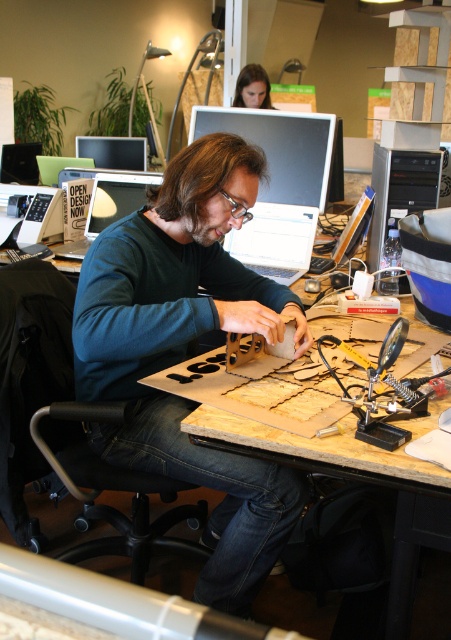
Question: Does blue matte shirt at center appear on the left side of matte black hair at upper center?

Choices:
 (A) yes
 (B) no

Answer: (A)

Question: Is matte black laptop at upper left positioned in front of matte black hair at upper center?

Choices:
 (A) yes
 (B) no

Answer: (A)

Question: Can you confirm if blue matte shirt at center is positioned above matte black laptop at upper left?

Choices:
 (A) yes
 (B) no

Answer: (B)

Question: Which is nearer to the black plastic tower at right?

Choices:
 (A) matte black laptop at upper left
 (B) matte black laptop at upper center
 (C) matte black hair at upper center

Answer: (B)

Question: Which of the following is the farthest from the observer?

Choices:
 (A) blue matte shirt at center
 (B) matte black hair at upper center
 (C) matte black laptop at upper center

Answer: (B)

Question: Which object is farther from the camera taking this photo?

Choices:
 (A) matte black laptop at upper center
 (B) blue matte shirt at center
 (C) soldering iron at center

Answer: (A)